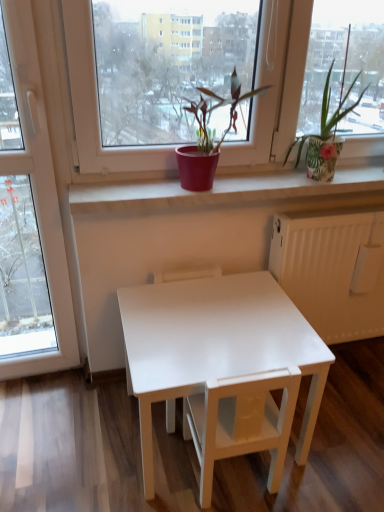
Question: Should I look upward or downward to see white matte chair at center, which appears as the 2th armchair when viewed from the back?

Choices:
 (A) down
 (B) up

Answer: (A)

Question: Which direction should I rotate to face matte red pot at center, acting as the second houseplant starting from the right, — up or down?

Choices:
 (A) down
 (B) up

Answer: (B)

Question: Would you consider white matte chair at center, positioned as the 1th armchair in front-to-back order, to be distant from green leafy plant at upper right, which ranks as the second houseplant in left-to-right order?

Choices:
 (A) no
 (B) yes

Answer: (A)

Question: Considering the relative positions of white matte chair at center, positioned as the 1th armchair in front-to-back order, and green leafy plant at upper right, the first houseplant positioned from the right, in the image provided, is white matte chair at center, positioned as the 1th armchair in front-to-back order, to the left of green leafy plant at upper right, the first houseplant positioned from the right, from the viewer's perspective?

Choices:
 (A) yes
 (B) no

Answer: (A)

Question: From the image's perspective, would you say white matte chair at center, positioned as the 1th armchair in front-to-back order, is positioned over green leafy plant at upper right, the first houseplant positioned from the right?

Choices:
 (A) no
 (B) yes

Answer: (A)

Question: Does white matte chair at center, which appears as the 2th armchair when viewed from the back, appear on the right side of green leafy plant at upper right, which ranks as the second houseplant in left-to-right order?

Choices:
 (A) yes
 (B) no

Answer: (B)

Question: Is white matte chair at center, positioned as the 1th armchair in front-to-back order, oriented towards green leafy plant at upper right, the first houseplant positioned from the right?

Choices:
 (A) no
 (B) yes

Answer: (A)

Question: Does white matte chair at center, positioned as the 1th armchair in front-to-back order, have a lesser height compared to green leafy plant at upper right, which ranks as the second houseplant in left-to-right order?

Choices:
 (A) no
 (B) yes

Answer: (A)

Question: Does white glossy table at center have a greater width compared to white glossy table at center, the first armchair viewed from the back?

Choices:
 (A) yes
 (B) no

Answer: (A)

Question: Considering the relative sizes of white glossy table at center and white glossy table at center, the first armchair viewed from the back, in the image provided, is white glossy table at center shorter than white glossy table at center, the first armchair viewed from the back,?

Choices:
 (A) yes
 (B) no

Answer: (A)

Question: Is white glossy table at center positioned beyond the bounds of white glossy table at center, the 2th armchair from the front?

Choices:
 (A) yes
 (B) no

Answer: (A)

Question: Is white glossy table at center, the 2th armchair from the front, completely or partially inside white glossy table at center?

Choices:
 (A) yes
 (B) no

Answer: (A)

Question: Does white glossy table at center turn towards white glossy table at center, the 2th armchair from the front?

Choices:
 (A) no
 (B) yes

Answer: (B)

Question: From a real-world perspective, is white glossy table at center located beneath white glossy table at center, the 2th armchair from the front?

Choices:
 (A) no
 (B) yes

Answer: (B)

Question: Does white glossy table at center touch white matte chair at center, positioned as the 1th armchair in front-to-back order?

Choices:
 (A) no
 (B) yes

Answer: (B)